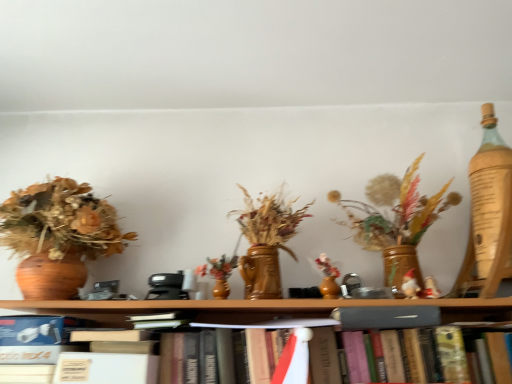
Question: Is hardcover book at center spatially inside matte gray book at center, or outside of it?

Choices:
 (A) inside
 (B) outside

Answer: (B)

Question: Looking at their shapes, would you say hardcover book at center is wider or thinner than matte gray book at center?

Choices:
 (A) thin
 (B) wide

Answer: (B)

Question: Is hardcover book at center taller or shorter than matte gray book at center?

Choices:
 (A) short
 (B) tall

Answer: (B)

Question: In terms of width, does matte gray book at center look wider or thinner when compared to hardcover book at center?

Choices:
 (A) thin
 (B) wide

Answer: (A)

Question: From the image's perspective, is matte gray book at center above or below hardcover book at center?

Choices:
 (A) below
 (B) above

Answer: (B)

Question: Is matte gray book at center to the left or to the right of hardcover book at center in the image?

Choices:
 (A) right
 (B) left

Answer: (A)

Question: Considering the positions of matte gray book at center and hardcover book at center in the image, is matte gray book at center taller or shorter than hardcover book at center?

Choices:
 (A) tall
 (B) short

Answer: (B)